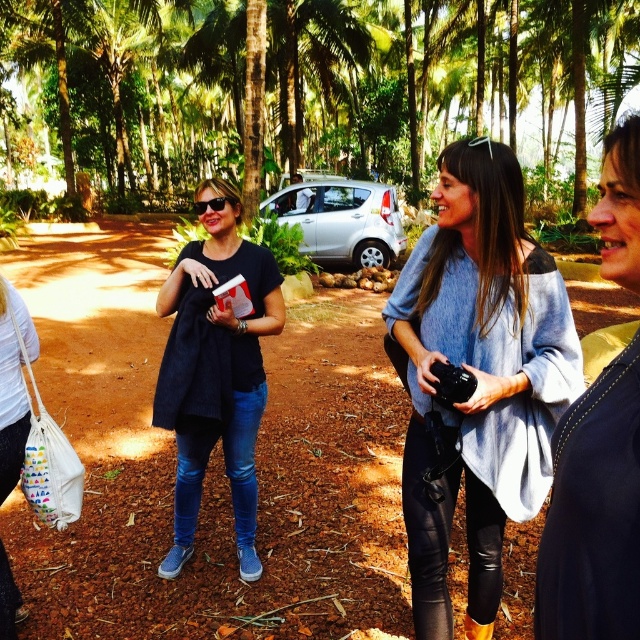
You are standing at the origin point in the image. There are two points marked in the scene. Which point is closer to you, point (356, 120) or point (520, 392)?

Point (520, 392) is closer to you because it is in front of point (356, 120).

You are planning to take a photo of the light blue sweater at center and the green leafy tree at center. Which object is wider?

The green leafy tree at center is wider than the light blue sweater at center.